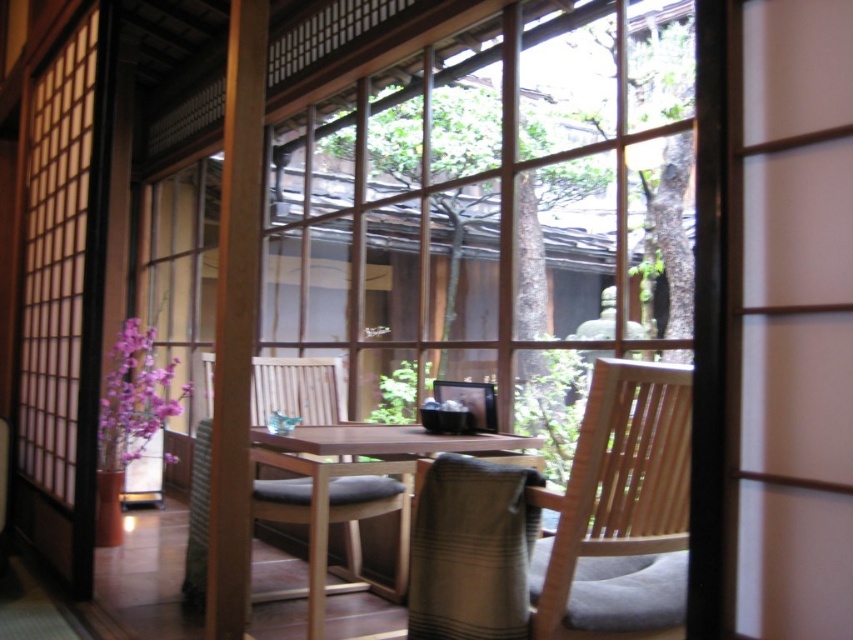
Question: Can you confirm if natural wood chair at center is positioned to the left of wooden chair at center?

Choices:
 (A) yes
 (B) no

Answer: (B)

Question: Can you confirm if translucent paper screen door at left is positioned below natural wood chair at center?

Choices:
 (A) no
 (B) yes

Answer: (A)

Question: Which point is closer to the camera taking this photo?

Choices:
 (A) (354, 467)
 (B) (590, 387)

Answer: (B)

Question: Is translucent paper screen door at left to the right of wooden table at center from the viewer's perspective?

Choices:
 (A) yes
 (B) no

Answer: (B)

Question: Among these objects, which one is farthest from the camera?

Choices:
 (A) translucent paper screen door at left
 (B) natural wood chair at center
 (C) wooden table at center
 (D) wooden chair at center

Answer: (A)

Question: Which object is closer to the camera taking this photo?

Choices:
 (A) wooden table at center
 (B) natural wood chair at center
 (C) wooden chair at center

Answer: (B)